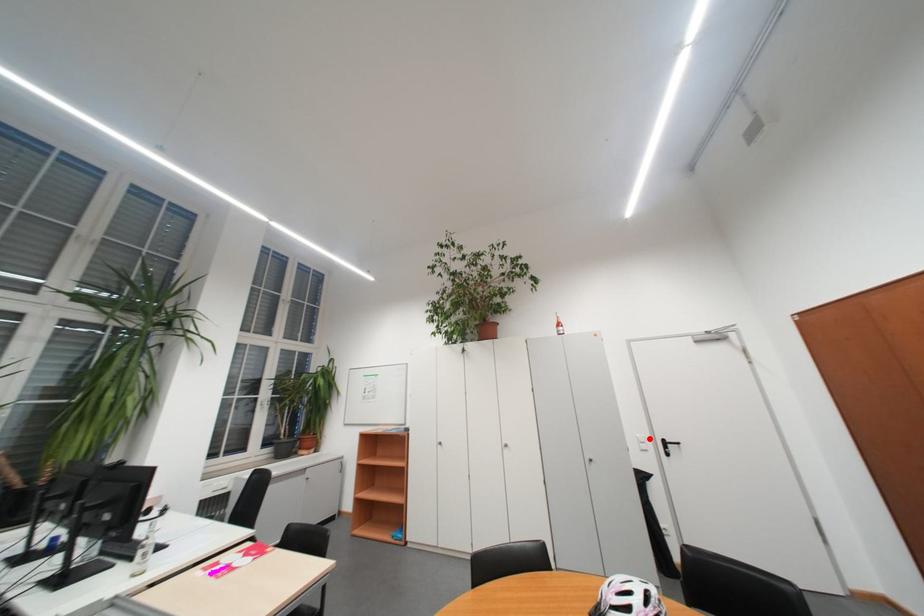
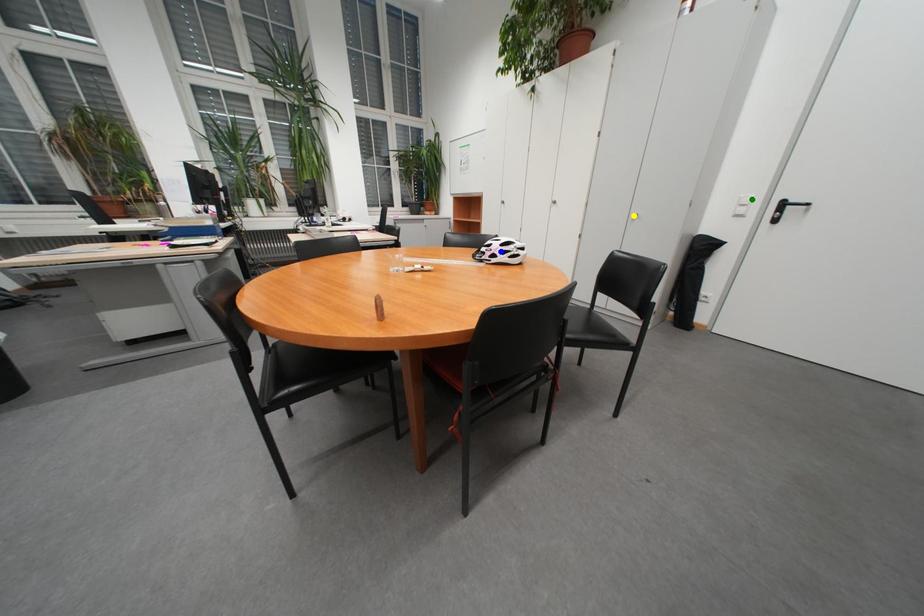
Question: I am providing you with two images of the same scene from different viewpoints. A red point is marked on the first image. You are given multiple points on the second image. Can you choose the point in image 2 that corresponds to the point in image 1?

Choices:
 (A) yellow point
 (B) green point
 (C) blue point

Answer: (B)